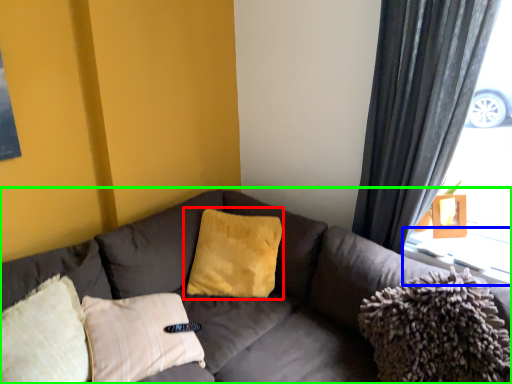
Question: Estimate the real-world distances between objects in this image. Which object is closer to pillow (highlighted by a red box), window sill (highlighted by a blue box) or studio couch (highlighted by a green box)?

Choices:
 (A) window sill
 (B) studio couch

Answer: (B)